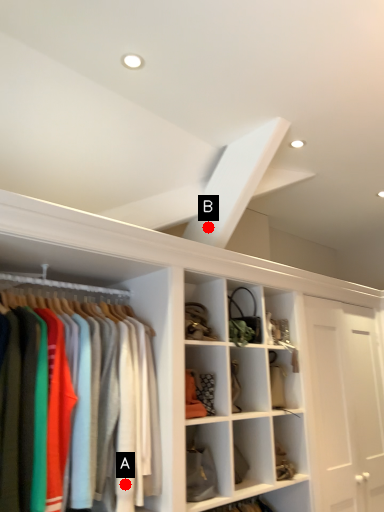
Question: Two points are circled on the image, labeled by A and B beside each circle. Among these points, which one is nearest to the camera?

Choices:
 (A) A is closer
 (B) B is closer

Answer: (A)